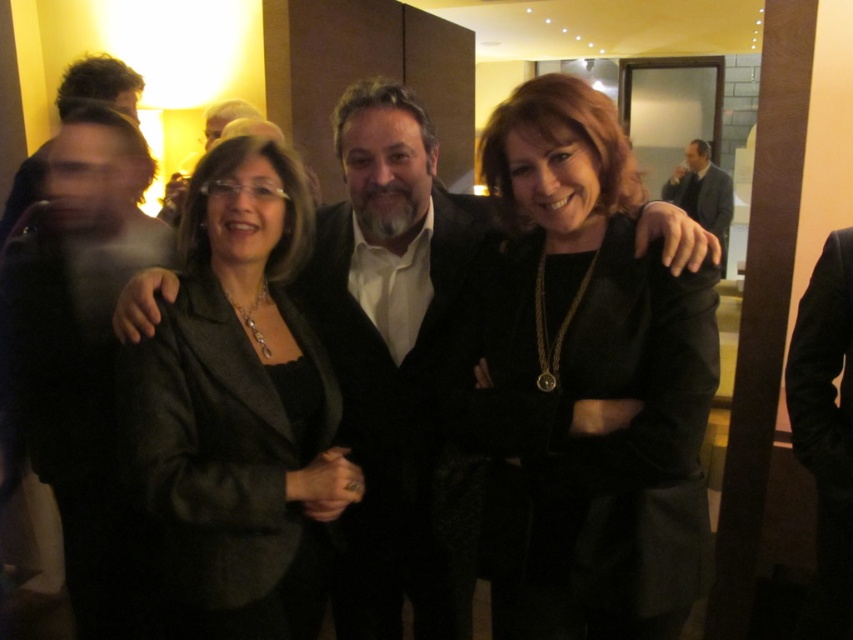
You are at a social event and need to locate two individuals based on their clothing. The first person is wearing a matte black suit at left, and the second is wearing a black matte blazer at center. According to the scene, which clothing item is positioned to the right of the other?

The black matte blazer at center is to the right of the matte black suit at left.

You are a photographer at the event and want to adjust the lighting so that the black matte blazer at center and the matte black suit at left are both visible. Since they are both black, how can you tell which one is higher up?

The black matte blazer at center is above the matte black suit at left, so the black matte blazer at center is the higher one.